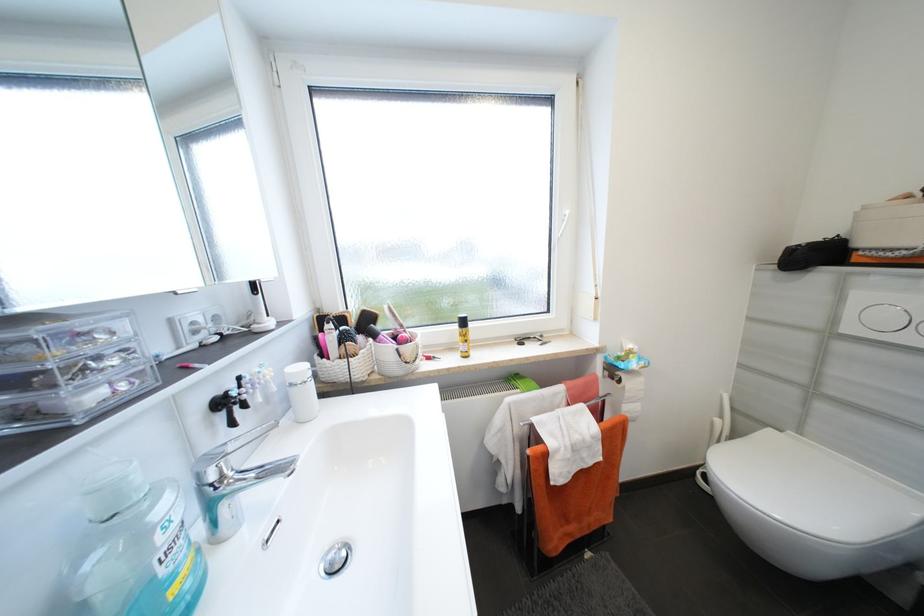
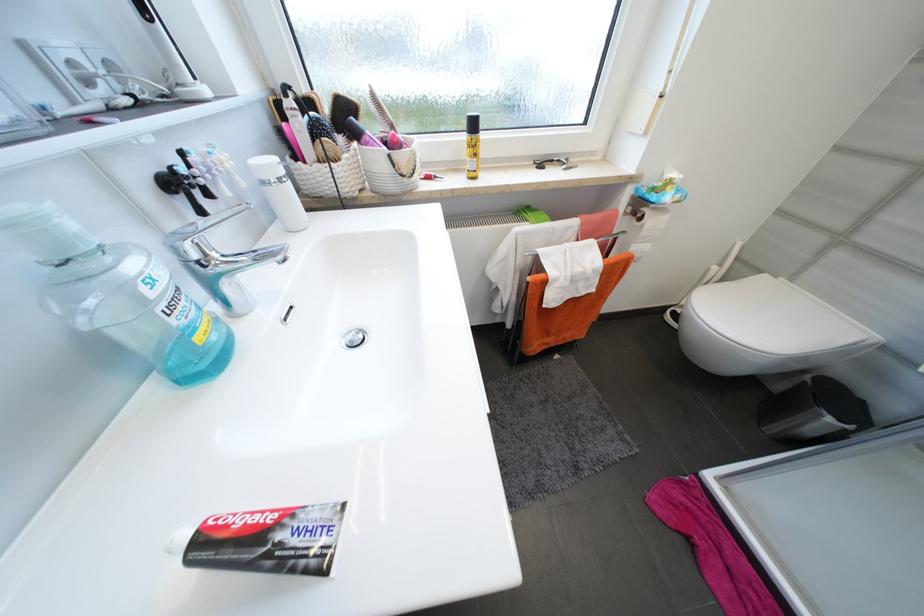
Where in the second image is the point corresponding to [468,347] from the first image?

(477, 166)